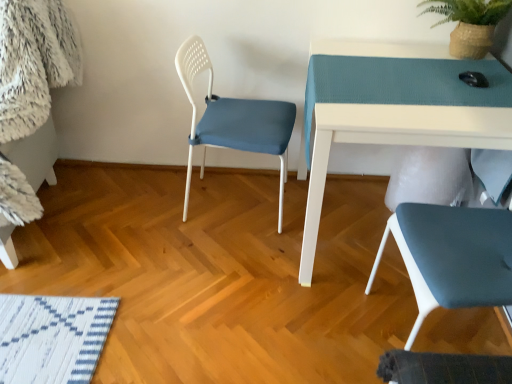
Question: Is point (352, 110) positioned closer to the camera than point (472, 6)?

Choices:
 (A) farther
 (B) closer

Answer: (B)

Question: From a real-world perspective, is white glossy table at upper right physically located above or below green woven basket at upper right?

Choices:
 (A) above
 (B) below

Answer: (B)

Question: Estimate the real-world distances between objects in this image. Which object is closer to the white plastic chair at center, which is the second chair from right to left?

Choices:
 (A) matte blue chair at lower right, placed as the 1th chair when sorted from right to left
 (B) white glossy table at upper right
 (C) green woven basket at upper right

Answer: (B)

Question: Which object is positioned farthest from the white glossy table at upper right?

Choices:
 (A) green woven basket at upper right
 (B) white plastic chair at center, acting as the first chair starting from the left
 (C) matte blue chair at lower right, which appears as the second chair when viewed from the left

Answer: (B)